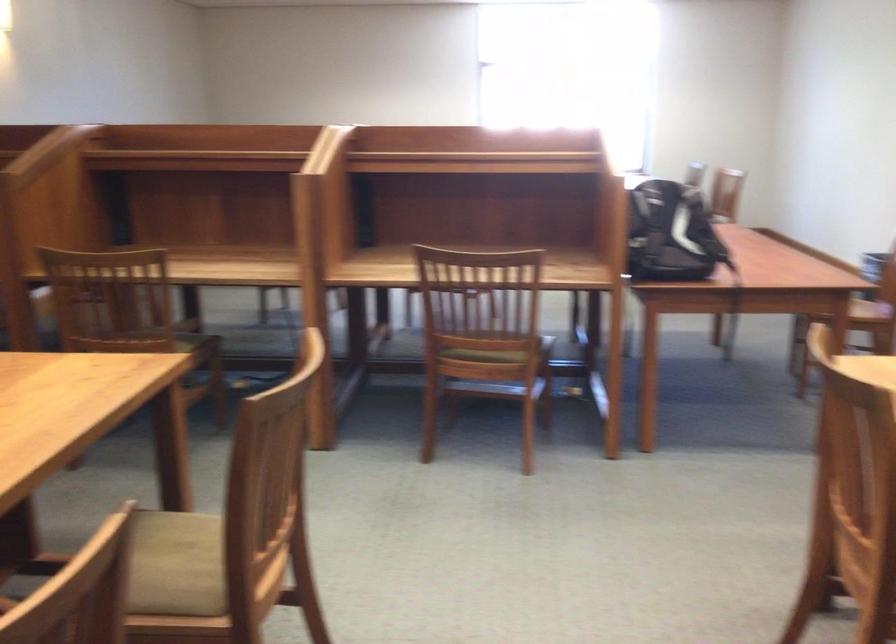
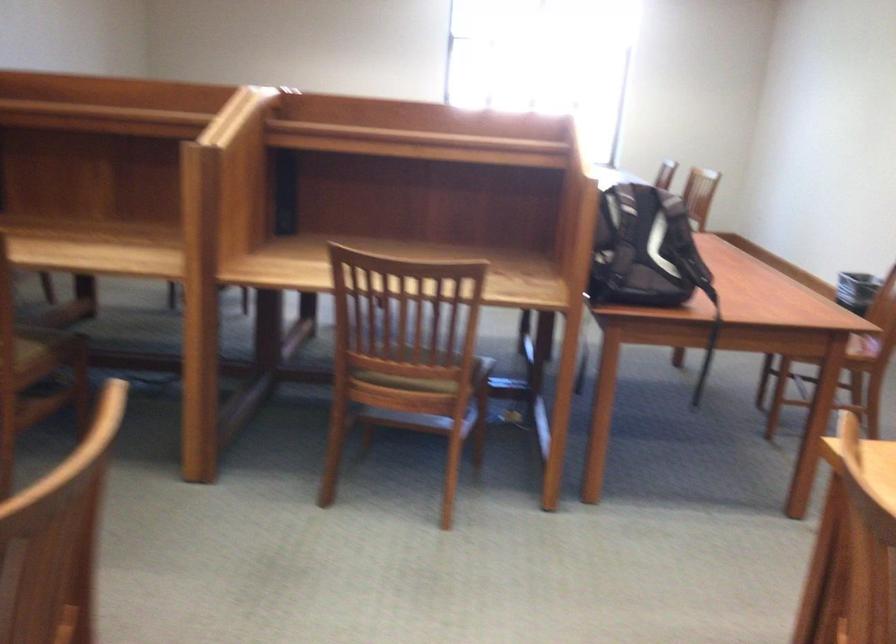
Question: Based on the continuous images, in which direction is the camera rotating? Reply with the corresponding letter.

Choices:
 (A) Left
 (B) Right
 (C) Up
 (D) Down

Answer: (B)